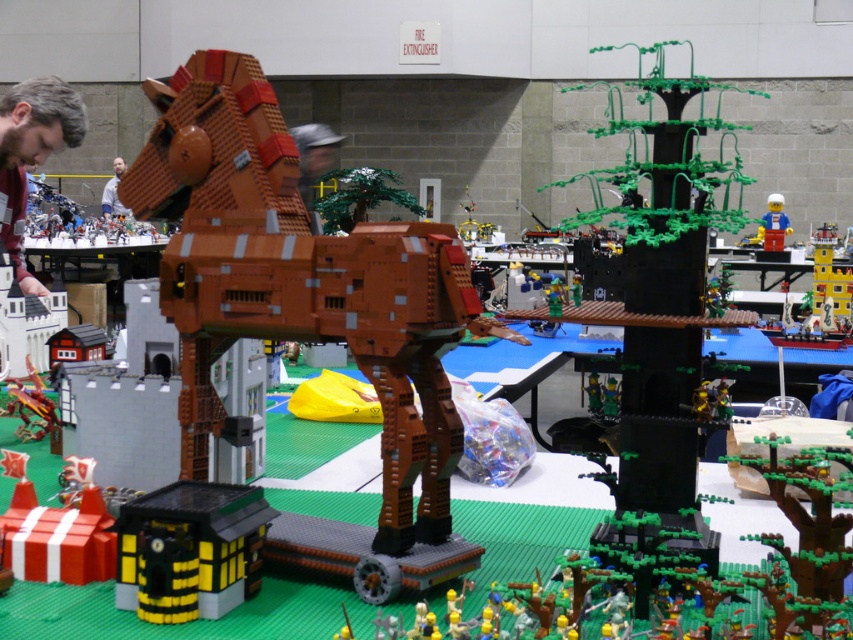
Question: Based on their relative distances, which object is farther from the light blue shirt at upper left?

Choices:
 (A) blue plastic minifigure at center
 (B) brown matte horse at center

Answer: (B)

Question: Is brown matte horse at center further to camera compared to light blue shirt at upper left?

Choices:
 (A) no
 (B) yes

Answer: (A)

Question: Does brown hair at upper left appear over light blue shirt at upper left?

Choices:
 (A) no
 (B) yes

Answer: (A)

Question: Is brown matte horse at center positioned before blue plastic minifigure at center?

Choices:
 (A) no
 (B) yes

Answer: (B)

Question: Which point is closer to the camera?

Choices:
 (A) (13, 122)
 (B) (763, 244)
 (C) (447, 275)

Answer: (C)

Question: Which object is positioned closest to the blue plastic minifigure at center?

Choices:
 (A) brown hair at upper left
 (B) light blue shirt at upper left
 (C) brown matte horse at center

Answer: (B)